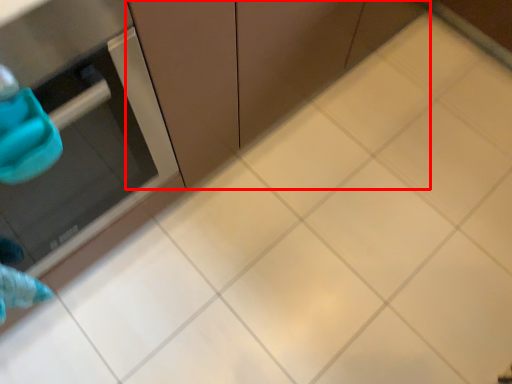
Question: Considering the relative positions of cabinetry (annotated by the red box) and appliance in the image provided, where is cabinetry (annotated by the red box) located with respect to the staircase?

Choices:
 (A) right
 (B) left

Answer: (A)